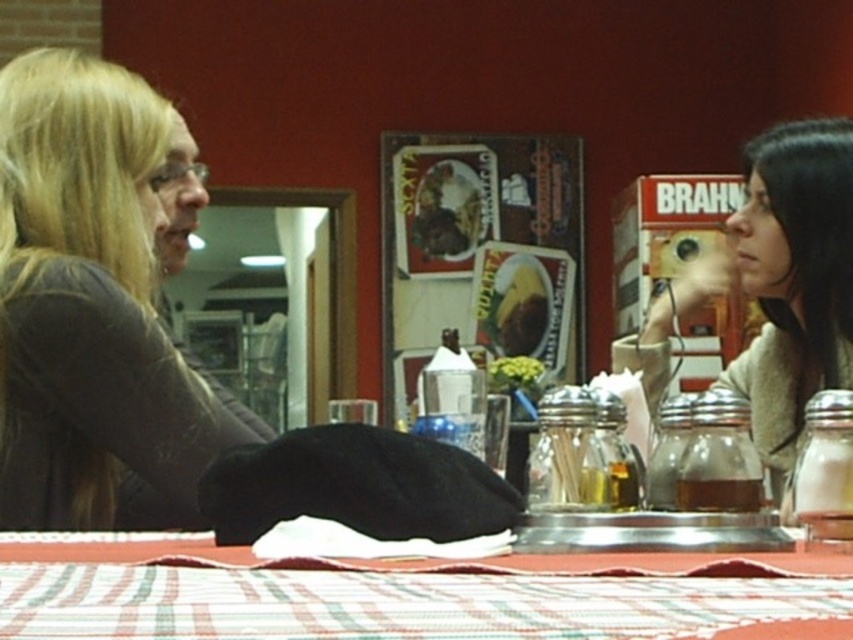
You are a delivery person who needs to place a small package between the dark gray sweater at left and the beige fabric jacket at right. Can you fit the package if it measures 1 meter in length?

The distance between the dark gray sweater at left and beige fabric jacket at right is 1.13 meters. Since the package is 1 meter long, it can fit comfortably within the space provided.

You are a customer sitting at the table in the image. You want to place your phone on the table so that it is as close as possible to the striped cotton tablecloth at center without overlapping it. Where should you place your phone?

The striped cotton tablecloth at center is located at point (412, 593). To place your phone as close as possible without overlapping, position it just adjacent to this coordinate, ensuring minimal distance while maintaining separation.